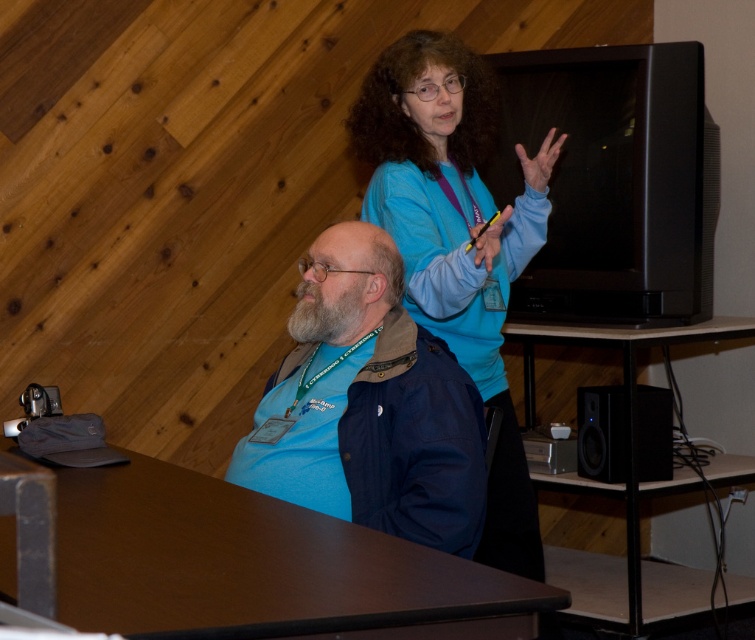
Is blue fabric shirt at upper center taller than dry skin hand at upper center?

Indeed, blue fabric shirt at upper center has a greater height compared to dry skin hand at upper center.

Is point (458, 157) positioned in front of point (527, 182)?

That is False.

This screenshot has height=640, width=755. What are the coordinates of `blue fabric shirt at upper center` in the screenshot? It's located at (453, 243).

Is brown wood table at lower left positioned behind blue fabric shirt at upper center?

No.

This screenshot has width=755, height=640. What do you see at coordinates (259, 566) in the screenshot?
I see `brown wood table at lower left` at bounding box center [259, 566].

You are a GUI agent. You are given a task and a screenshot of the screen. Output one action in this format:
    pyautogui.click(x=<x>, y=<y>)
    Task: Click on the brown wood table at lower left
    The height and width of the screenshot is (640, 755).
    Given the screenshot: What is the action you would take?
    pyautogui.click(x=259, y=566)

I want to click on blue fabric shirt at upper center, so click(453, 243).

At what (x,y) coordinates should I click in order to perform the action: click on blue fabric shirt at upper center. Please return your answer as a coordinate pair (x, y). Looking at the image, I should click on (453, 243).

Locate an element on the screen. blue fabric shirt at upper center is located at coordinates (453, 243).